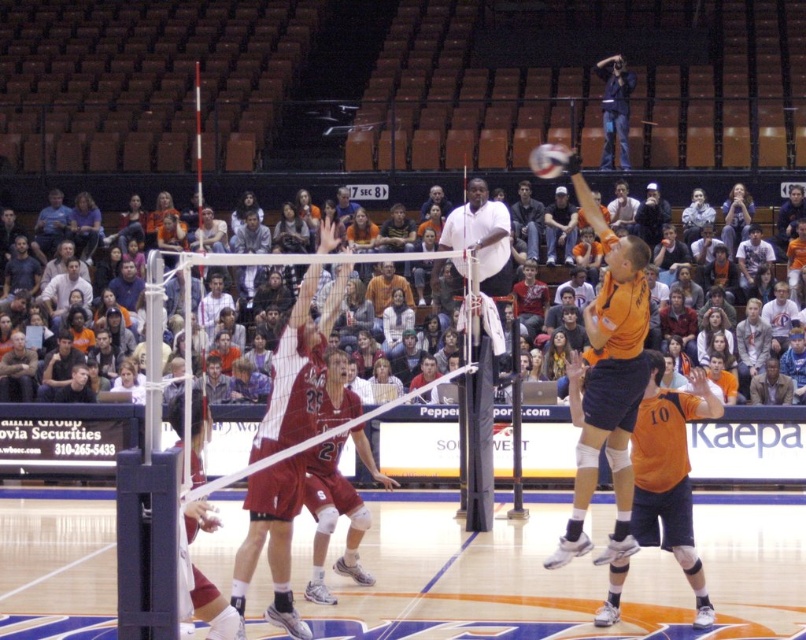
Question: Which point is farther from the camera taking this photo?

Choices:
 (A) (796, 624)
 (B) (538, 161)
 (C) (244, 184)

Answer: (C)

Question: Is orange uniformed player at center smaller than orange casual clothing at upper center?

Choices:
 (A) no
 (B) yes

Answer: (B)

Question: Is orange casual clothing at upper center further to camera compared to white matte volleyball at center?

Choices:
 (A) no
 (B) yes

Answer: (B)

Question: Which point appears farthest from the camera in this image?

Choices:
 (A) (85, 586)
 (B) (512, 176)

Answer: (B)

Question: Is orange uniformed player at center positioned before orange casual clothing at upper center?

Choices:
 (A) no
 (B) yes

Answer: (B)

Question: Which is nearer to the orange casual clothing at upper center?

Choices:
 (A) orange uniformed player at center
 (B) white matte volleyball at center

Answer: (B)